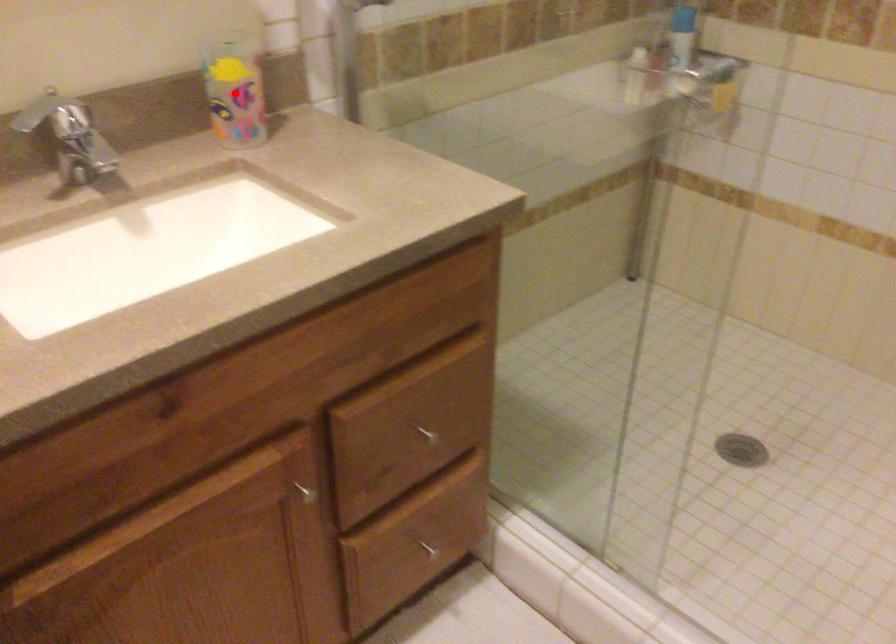
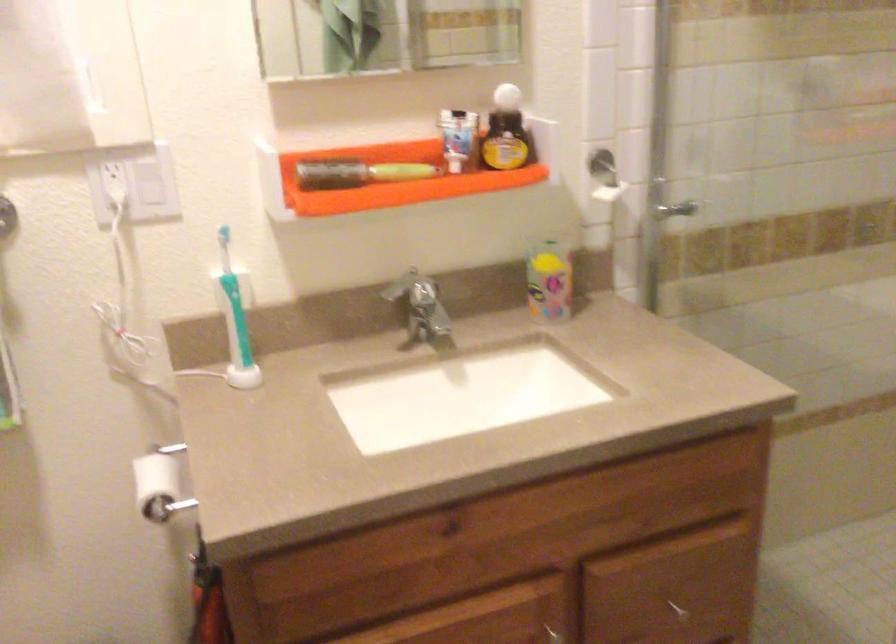
Question: I am providing you with two images of the same scene from different viewpoints. A red point is shown in image1. For the corresponding object point in image2, is it positioned nearer or farther from the camera?

Choices:
 (A) Nearer
 (B) Farther

Answer: (B)